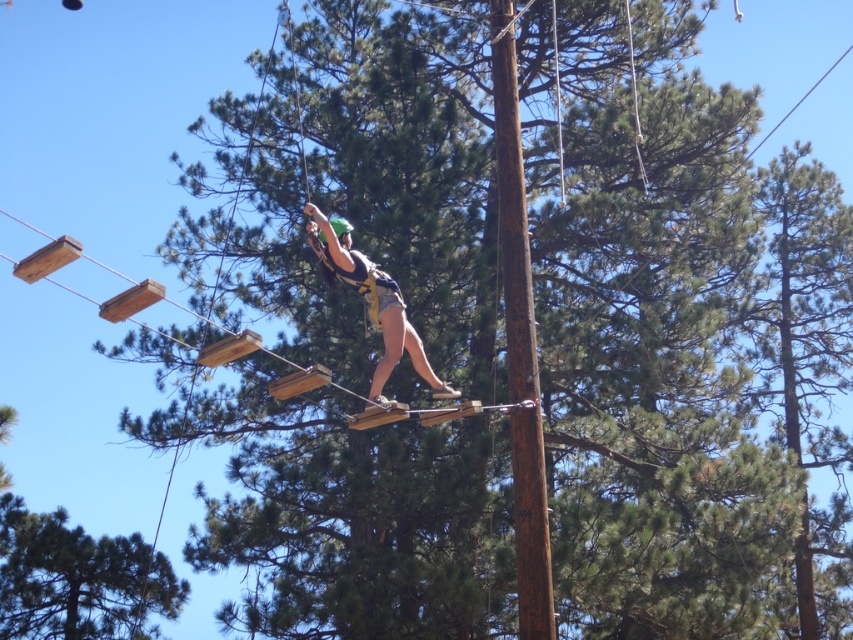
Question: Does green pine tree at lower left have a greater width compared to matte black harness at center?

Choices:
 (A) no
 (B) yes

Answer: (B)

Question: Does brown wood telegraph pole at center have a greater width compared to matte black harness at center?

Choices:
 (A) no
 (B) yes

Answer: (A)

Question: Among these objects, which one is nearest to the camera?

Choices:
 (A) green pine tree at lower left
 (B) brown wood telegraph pole at center

Answer: (B)

Question: Which point is farther to the camera?

Choices:
 (A) brown wood telegraph pole at center
 (B) matte black harness at center

Answer: (A)

Question: Does green pine tree at lower left lie in front of matte black harness at center?

Choices:
 (A) no
 (B) yes

Answer: (A)

Question: Which object appears farthest from the camera in this image?

Choices:
 (A) matte black harness at center
 (B) brown wood telegraph pole at center
 (C) green pine tree at lower left

Answer: (C)